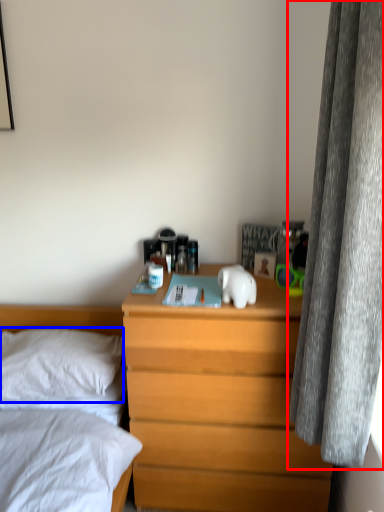
Question: Which of the following is the closest to the observer, curtain (highlighted by a red box) or pillow (highlighted by a blue box)?

Choices:
 (A) curtain
 (B) pillow

Answer: (A)